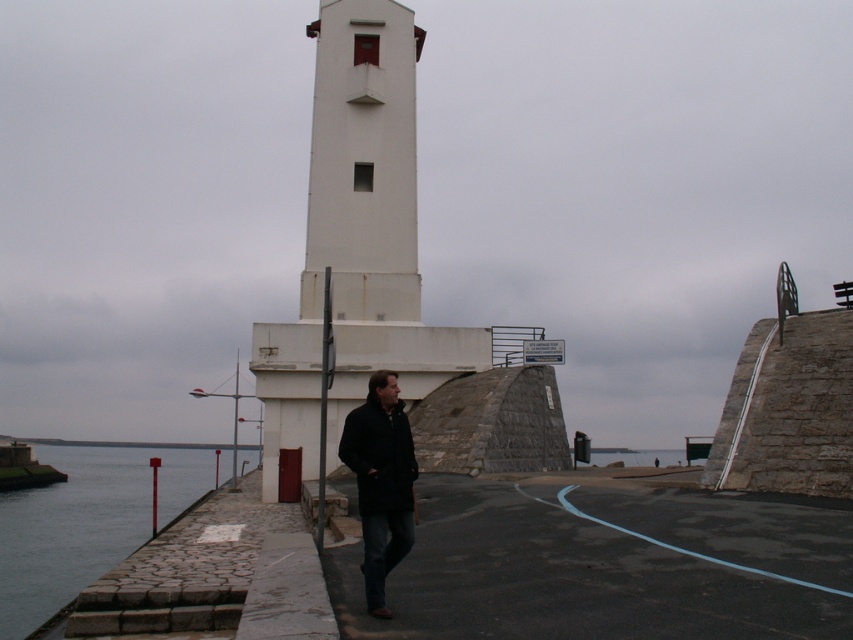
Question: Is gray cobblestone water at lower left bigger than black matte coat at center?

Choices:
 (A) yes
 (B) no

Answer: (A)

Question: Is white smooth tower at center to the right of gray cobblestone water at lower left from the viewer's perspective?

Choices:
 (A) no
 (B) yes

Answer: (B)

Question: Based on their relative distances, which object is nearer to the white smooth tower at center?

Choices:
 (A) gray cobblestone water at lower left
 (B) white matte/lightweight tower at center

Answer: (B)

Question: Which of these objects is positioned closest to the black matte coat at center?

Choices:
 (A) white matte/lightweight tower at center
 (B) white smooth tower at center

Answer: (A)

Question: Estimate the real-world distances between objects in this image. Which object is closer to the white matte/lightweight tower at center?

Choices:
 (A) gray cobblestone water at lower left
 (B) black matte coat at center
 (C) white smooth tower at center

Answer: (C)

Question: Does white matte/lightweight tower at center have a smaller size compared to white smooth tower at center?

Choices:
 (A) no
 (B) yes

Answer: (A)